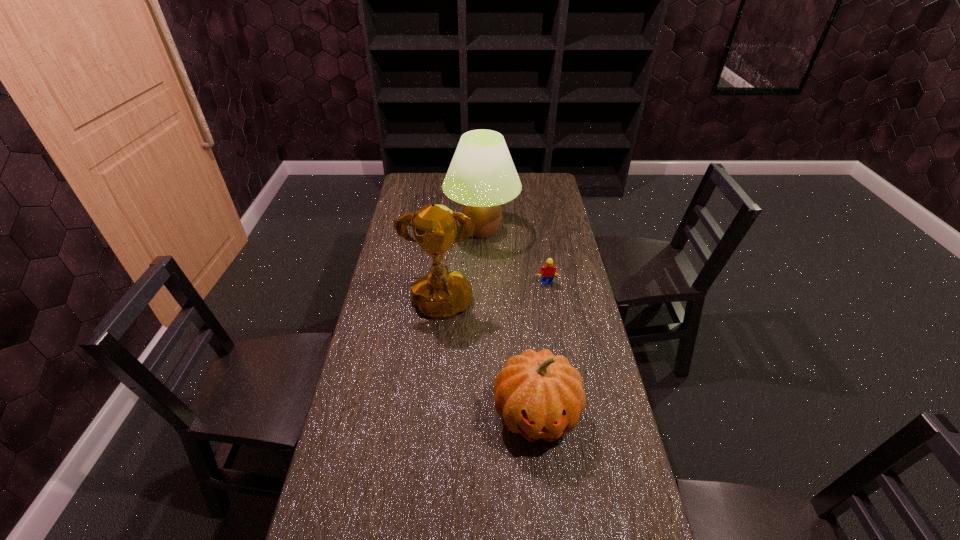
Find the location of a particular element. pumpkin situated at the right edge is located at coordinates pos(539,395).

Locate an element on the screen. The width and height of the screenshot is (960, 540). Lego positioned at the right edge is located at coordinates 548,270.

The width and height of the screenshot is (960, 540). Identify the location of free region at the left edge of the desktop. (372, 293).

Where is `vacant space at the right edge`? The height and width of the screenshot is (540, 960). vacant space at the right edge is located at coordinates (553, 263).

You are a GUI agent. You are given a task and a screenshot of the screen. Output one action in this format:
    pyautogui.click(x=<x>, y=<y>)
    Task: Click on the free space at the far left corner of the desktop
    
    Given the screenshot: What is the action you would take?
    420,190

The width and height of the screenshot is (960, 540). I want to click on free point between the lampshade and the pumpkin, so click(509, 322).

Where is `vacant space in between the Lego and the pumpkin`? vacant space in between the Lego and the pumpkin is located at coordinates (x=540, y=349).

Identify the location of free space that is in between the third tallest object and the farthest object. (509, 322).

Locate an element on the screen. This screenshot has width=960, height=540. free space between the Lego and the nearest object is located at coordinates (540, 349).

The height and width of the screenshot is (540, 960). I want to click on blank region between the nearest object and the shortest object, so click(540, 349).